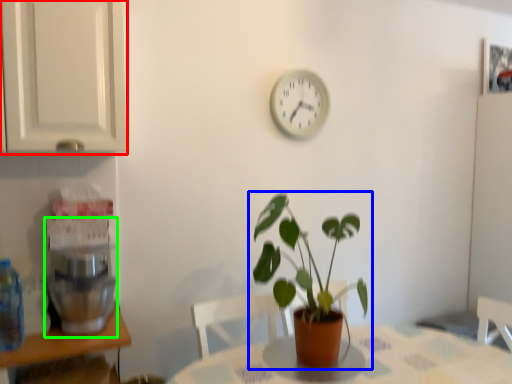
Question: Which object is positioned farthest from cabinetry (highlighted by a red box)? Select from houseplant (highlighted by a blue box) and coffee machine (highlighted by a green box).

Choices:
 (A) houseplant
 (B) coffee machine

Answer: (A)